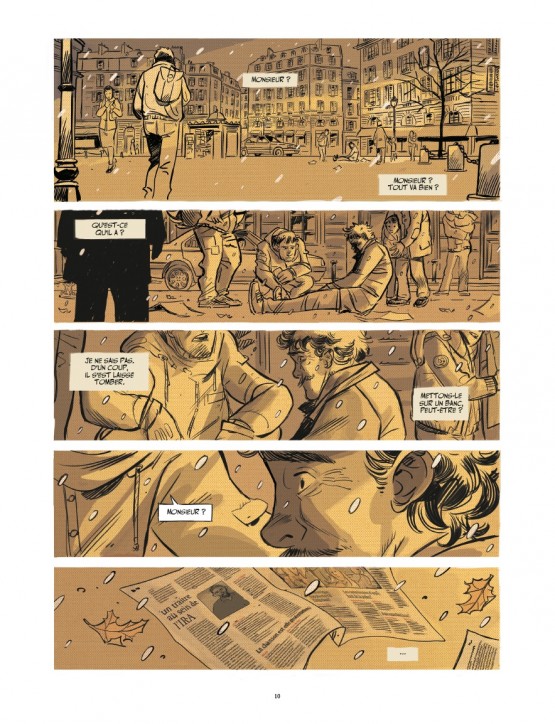
Identify the location of newspaper. The width and height of the screenshot is (555, 724). pos(242,631).